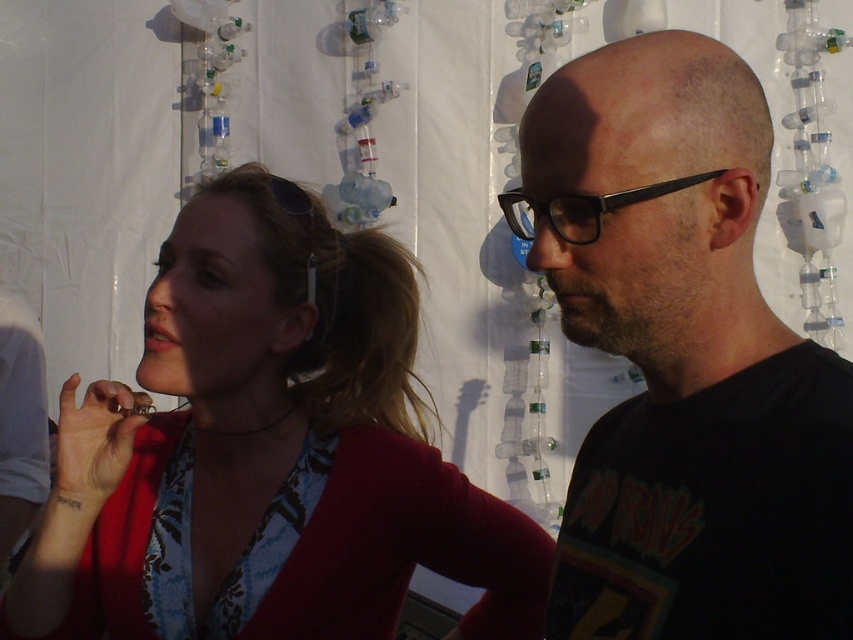
Which is more to the left, matte red sweater at center or black matte shirt at center?

matte red sweater at center

Measure the distance between point (496, 532) and camera.

Point (496, 532) is 1.30 meters from camera.

Which is in front, point (167, 545) or point (664, 609)?

Point (664, 609) is more forward.

At what (x,y) coordinates should I click in order to perform the action: click on matte red sweater at center. Please return your answer as a coordinate pair (x, y). This screenshot has width=853, height=640. Looking at the image, I should click on (265, 452).

Is point (88, 502) positioned before point (569, 212)?

No, it is not.

What do you see at coordinates (265, 452) in the screenshot? I see `matte red sweater at center` at bounding box center [265, 452].

You are a GUI agent. You are given a task and a screenshot of the screen. Output one action in this format:
    pyautogui.click(x=<x>, y=<y>)
    Task: Click on the matte red sweater at center
    
    Given the screenshot: What is the action you would take?
    pyautogui.click(x=265, y=452)

Between point (651, 387) and point (578, 202), which one is positioned behind?

Positioned behind is point (651, 387).

Is black matte shirt at center below black plastic glasses at center?

Yes, black matte shirt at center is below black plastic glasses at center.

Who is more forward, [780,420] or [589,198]?

Point [589,198] is more forward.

Identify the location of black matte shirt at center. The height and width of the screenshot is (640, 853). click(683, 358).